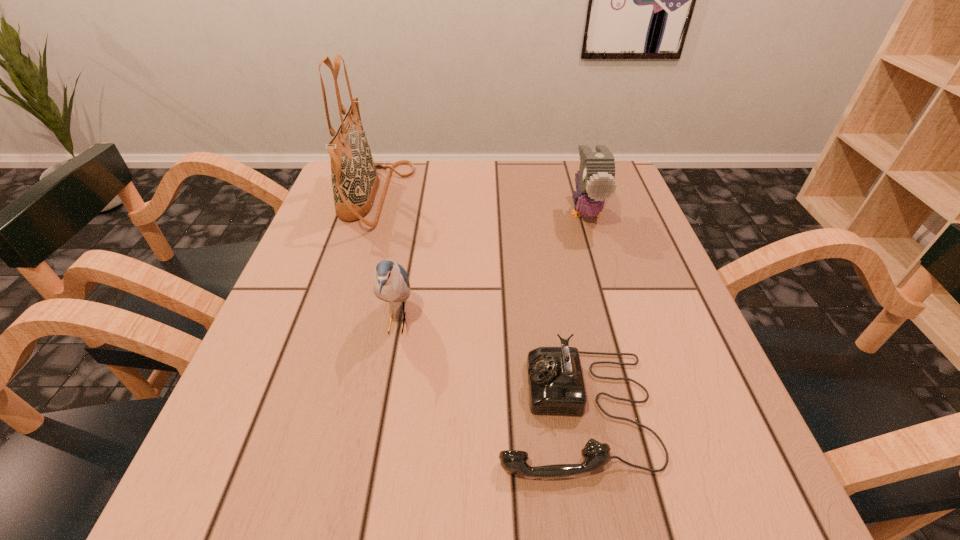
In order to click on free area in between the telephone and the second nearest object in this screenshot , I will do `click(486, 366)`.

Image resolution: width=960 pixels, height=540 pixels. In order to click on free point between the left bird and the farther bird in this screenshot , I will do `click(492, 267)`.

I want to click on vacant area that lies between the second nearest object and the handbag, so click(x=386, y=260).

The height and width of the screenshot is (540, 960). In order to click on vacant area that lies between the nearer bird and the nearest object in this screenshot , I will do `click(486, 366)`.

You are a GUI agent. You are given a task and a screenshot of the screen. Output one action in this format:
    pyautogui.click(x=<x>, y=<y>)
    Task: Click on the blank region between the shortest object and the second nearest object
    This screenshot has width=960, height=540.
    Given the screenshot: What is the action you would take?
    pyautogui.click(x=486, y=366)

Where is `free space between the tallest object and the nearest object`? free space between the tallest object and the nearest object is located at coordinates (475, 303).

Locate an element on the screen. The width and height of the screenshot is (960, 540). object that stands as the third closest to the left bird is located at coordinates (595, 180).

Identify which object is the nearest to the nearer bird. Please provide its 2D coordinates. Your answer should be formatted as a tuple, i.e. [(x, y)], where the tuple contains the x and y coordinates of a point satisfying the conditions above.

[(556, 386)]

Where is `vacant space that satisfies the following two spatial constraints: 1. at the beak of the right bird; 2. on the dial of the nearest object`? vacant space that satisfies the following two spatial constraints: 1. at the beak of the right bird; 2. on the dial of the nearest object is located at coordinates (645, 410).

The image size is (960, 540). I want to click on vacant space that satisfies the following two spatial constraints: 1. at the beak of the farther bird; 2. on the dial of the telephone, so click(x=645, y=410).